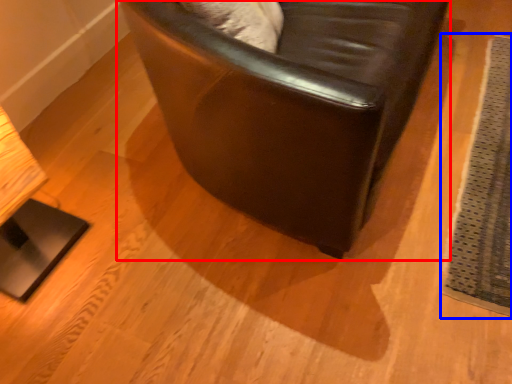
Question: Which object appears closest to the camera in this image, chair (highlighted by a red box) or mat (highlighted by a blue box)?

Choices:
 (A) chair
 (B) mat

Answer: (A)